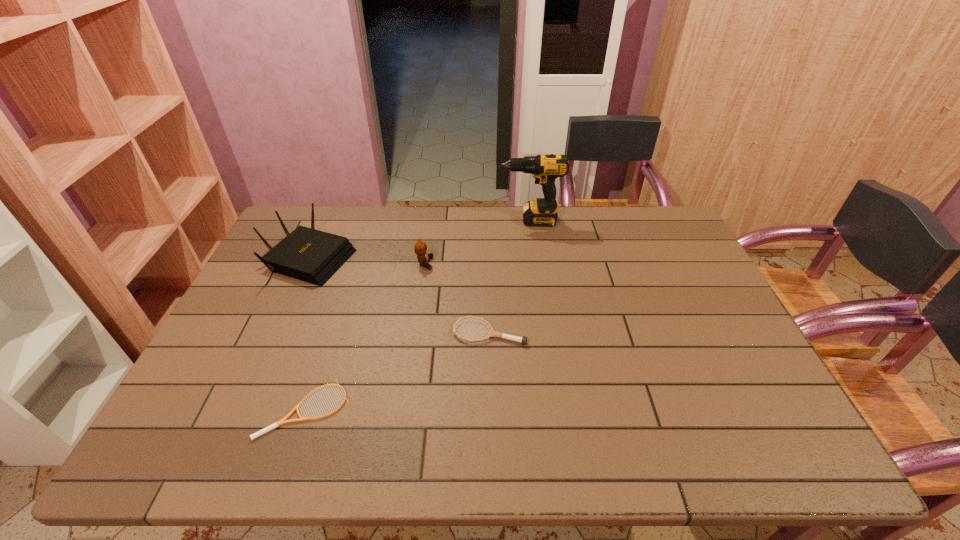
This screenshot has height=540, width=960. In order to click on object located in the far left corner section of the desktop in this screenshot , I will do `click(313, 256)`.

Where is `free location at the far edge of the desktop`? This screenshot has height=540, width=960. free location at the far edge of the desktop is located at coordinates [372, 225].

This screenshot has width=960, height=540. Find the location of `vacant space at the near edge of the desktop`. vacant space at the near edge of the desktop is located at coordinates (305, 429).

In the image, there is a desktop. Where is `vacant space at the left edge`? The height and width of the screenshot is (540, 960). vacant space at the left edge is located at coordinates (252, 308).

The image size is (960, 540). I want to click on free point at the right edge, so 703,296.

You are a GUI agent. You are given a task and a screenshot of the screen. Output one action in this format:
    pyautogui.click(x=<x>, y=<y>)
    Task: Click on the free space between the router and the farther tennis racket
    Image resolution: width=960 pixels, height=540 pixels.
    Given the screenshot: What is the action you would take?
    pyautogui.click(x=400, y=294)

You are a GUI agent. You are given a task and a screenshot of the screen. Output one action in this format:
    pyautogui.click(x=<x>, y=<y>)
    Task: Click on the vacant point located between the router and the shorter tennis racket
    The image size is (960, 540).
    Given the screenshot: What is the action you would take?
    pyautogui.click(x=308, y=333)

Where is `empty space that is in between the fourth shortest object and the teddy bear`? The width and height of the screenshot is (960, 540). empty space that is in between the fourth shortest object and the teddy bear is located at coordinates (368, 260).

Locate an element on the screen. empty space between the third object from left to right and the router is located at coordinates (368, 260).

You are a GUI agent. You are given a task and a screenshot of the screen. Output one action in this format:
    pyautogui.click(x=<x>, y=<y>)
    Task: Click on the vacant area between the router and the taller tennis racket
    The height and width of the screenshot is (540, 960).
    Given the screenshot: What is the action you would take?
    pyautogui.click(x=400, y=294)